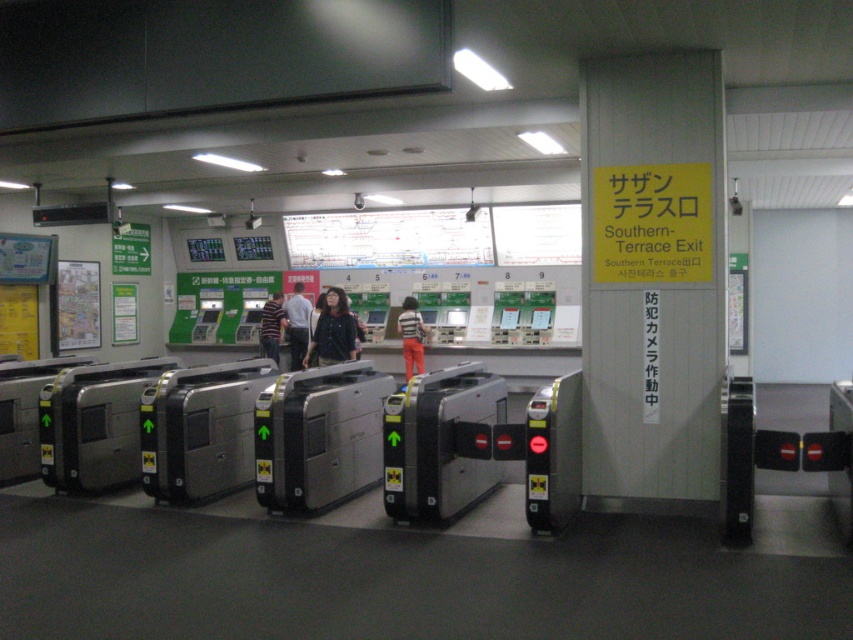
Question: Can you confirm if dark blue jacket at center is bigger than striped cotton shirt at center?

Choices:
 (A) no
 (B) yes

Answer: (B)

Question: Which object appears farthest from the camera in this image?

Choices:
 (A) striped cotton shirt at center
 (B) striped shirt at center

Answer: (A)

Question: Which object appears closest to the camera in this image?

Choices:
 (A) dark blue jacket at center
 (B) striped cotton shirt at center
 (C) striped shirt at center

Answer: (A)

Question: Is dark blue jacket at center above dark blue shirt at center?

Choices:
 (A) yes
 (B) no

Answer: (A)

Question: Which point is closer to the camera taking this photo?

Choices:
 (A) (276, 339)
 (B) (416, 342)

Answer: (B)

Question: Is striped shirt at center positioned before striped cotton shirt at center?

Choices:
 (A) yes
 (B) no

Answer: (A)